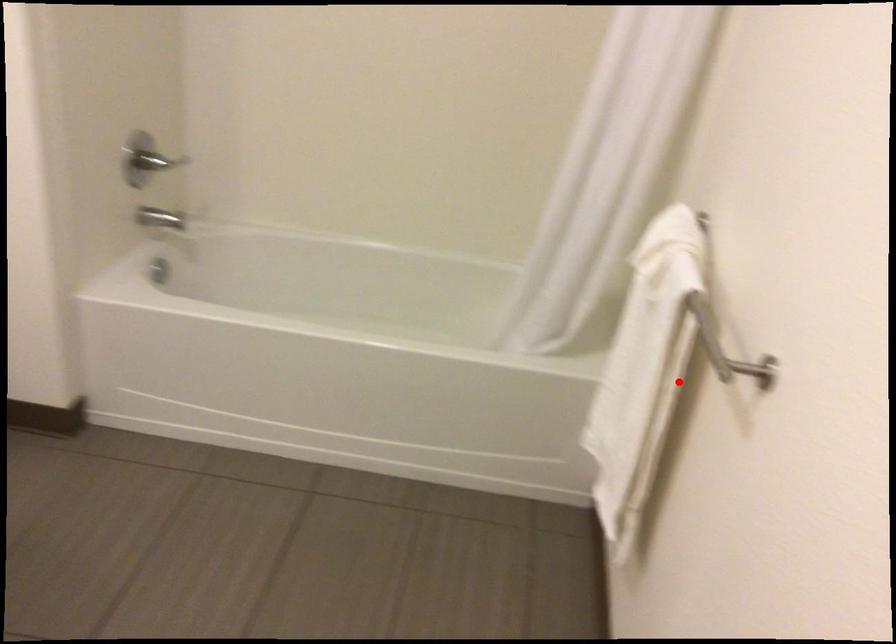
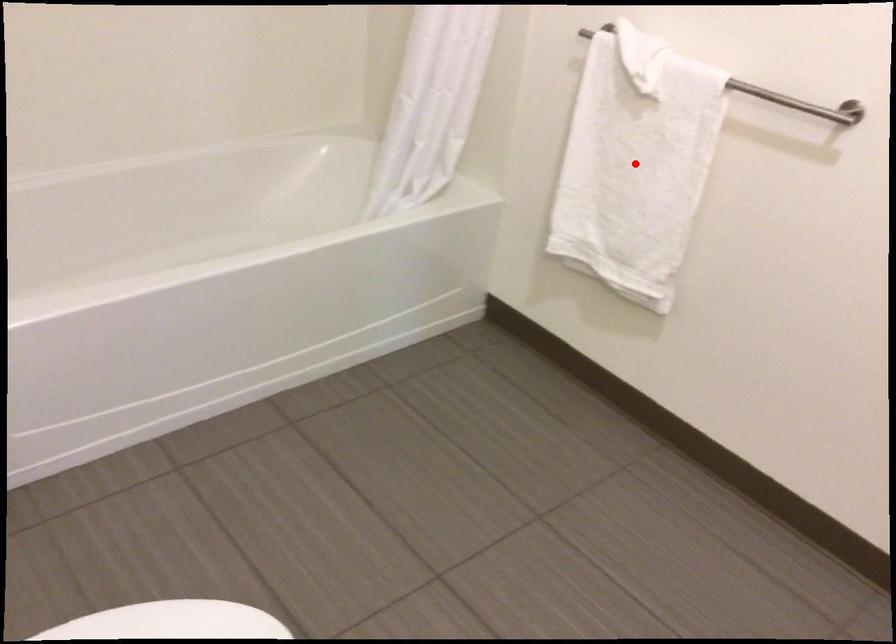
I am providing you with two images of the same scene from different viewpoints. A red point is marked on the first image and another point is marked on the second image. Do the highlighted points in image1 and image2 indicate the same real-world spot?

Yes